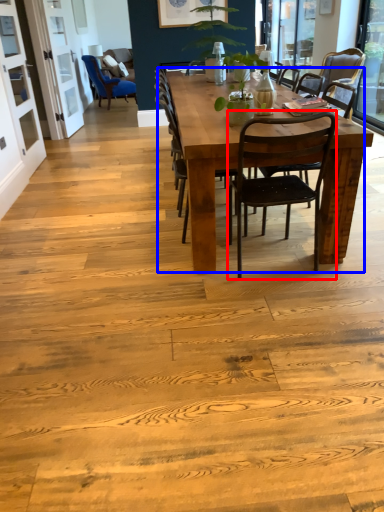
Question: Which object appears farthest to the camera in this image, chair (highlighted by a red box) or kitchen & dining room table (highlighted by a blue box)?

Choices:
 (A) chair
 (B) kitchen & dining room table

Answer: (B)